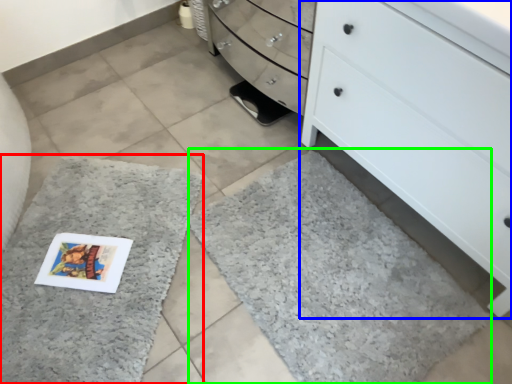
Question: Estimate the real-world distances between objects in this image. Which object is farther from bath mat (highlighted by a red box), chest of drawers (highlighted by a blue box) or bath mat (highlighted by a green box)?

Choices:
 (A) chest of drawers
 (B) bath mat

Answer: (A)